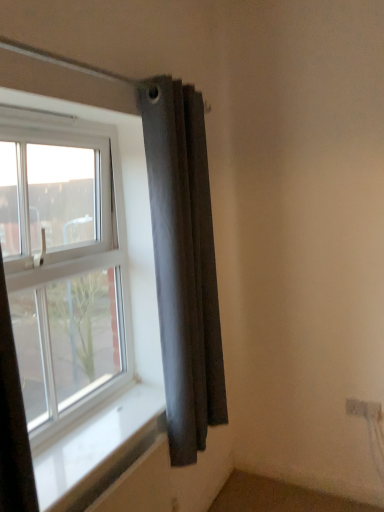
Question: Would you say dark gray fabric curtain at upper right is inside or outside white smooth window sill at lower left?

Choices:
 (A) inside
 (B) outside

Answer: (B)

Question: From the image's perspective, is dark gray fabric curtain at upper right above or below white smooth window sill at lower left?

Choices:
 (A) below
 (B) above

Answer: (B)

Question: Which of these objects is positioned closest to the white smooth window sill at lower left?

Choices:
 (A) white plastic window at upper left
 (B) dark gray fabric curtain at upper right

Answer: (A)

Question: Estimate the real-world distances between objects in this image. Which object is closer to the dark gray fabric curtain at upper right?

Choices:
 (A) white smooth window sill at lower left
 (B) white plastic window at upper left

Answer: (B)